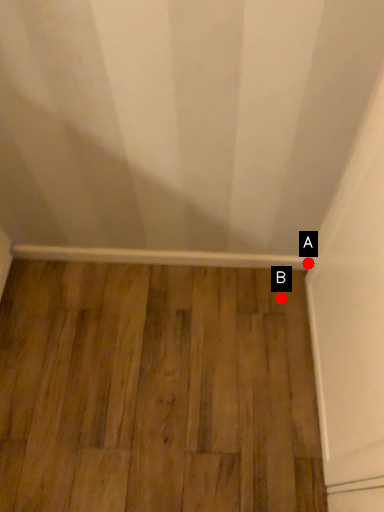
Question: Two points are circled on the image, labeled by A and B beside each circle. Which point appears farthest from the camera in this image?

Choices:
 (A) A is further
 (B) B is further

Answer: (B)